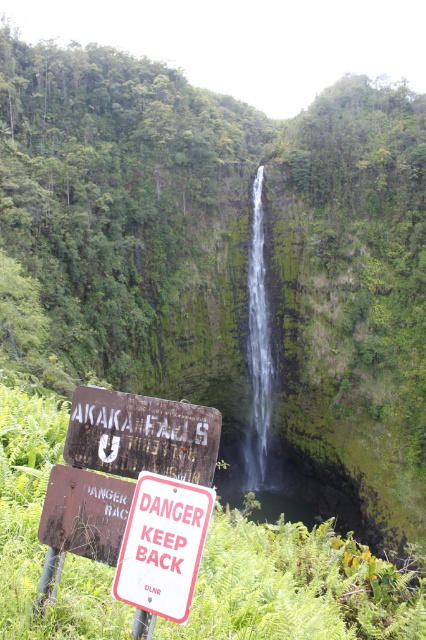
Which of these two, rusty wood sign at lower center or red plastic sign at lower center, stands taller?

red plastic sign at lower center is taller.

Does rusty wood sign at lower center have a lesser width compared to red plastic sign at lower center?

No, rusty wood sign at lower center is not thinner than red plastic sign at lower center.

What do you see at coordinates (141, 435) in the screenshot?
I see `rusty wood sign at lower center` at bounding box center [141, 435].

Locate an element on the screen. The height and width of the screenshot is (640, 426). rusty wood sign at lower center is located at coordinates (141, 435).

Between rusty wood sign at lower center and clear glass waterfall at center, which one is positioned higher?

clear glass waterfall at center is above.

Does rusty wood sign at lower center appear under clear glass waterfall at center?

Correct, rusty wood sign at lower center is located below clear glass waterfall at center.

Does point (129, 442) come behind point (262, 464)?

No, it is in front of (262, 464).

Image resolution: width=426 pixels, height=640 pixels. I want to click on rusty wood sign at lower center, so click(x=141, y=435).

Is red plastic sign at lower center positioned at the back of clear glass waterfall at center?

No.

Which is in front, point (135, 561) or point (256, 372)?

Point (135, 561) is in front.

Locate an element on the screen. The image size is (426, 640). red plastic sign at lower center is located at coordinates (163, 547).